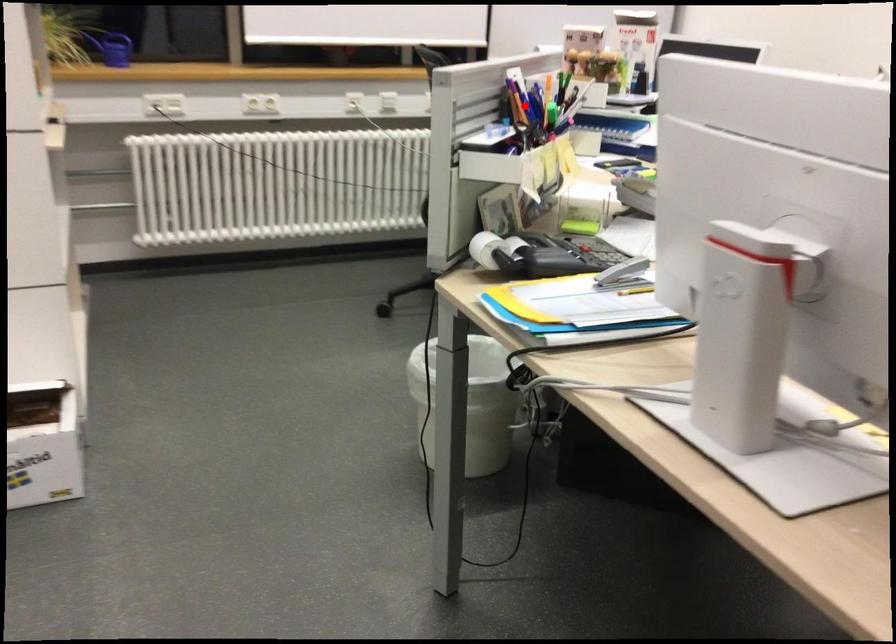
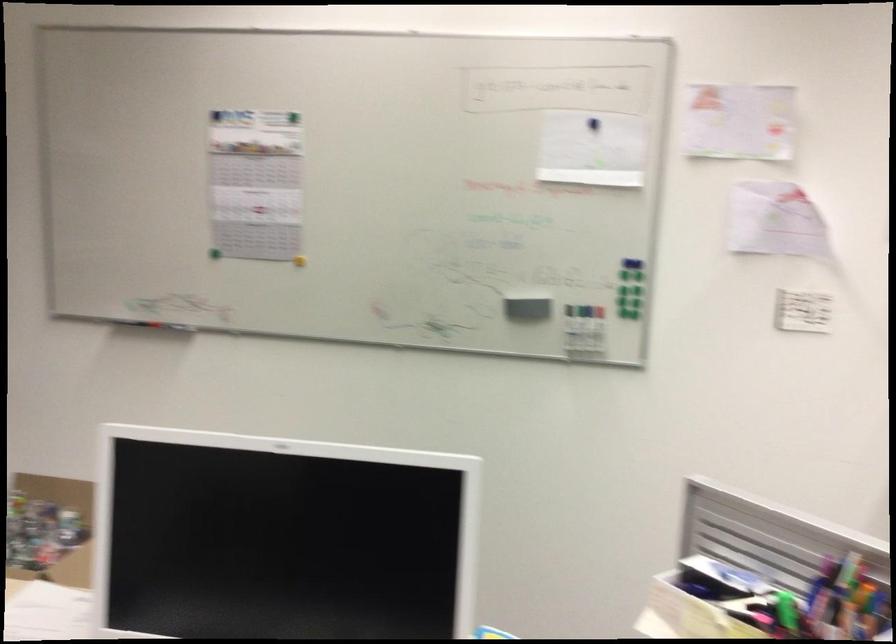
The point at the highlighted location is marked in the first image. Where is the corresponding point in the second image?

(787, 610)